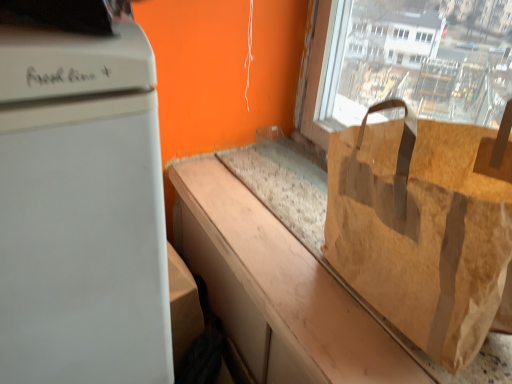
Find the location of `brown paper bag at right`. brown paper bag at right is located at coordinates (424, 226).

There is a brown paper bag at center. Identify the location of grocery bag above it (from a real-world perspective). The image size is (512, 384). (424, 226).

From the image's perspective, is brown paper bag at right above or below brown paper bag at center?

From the image's perspective, brown paper bag at right appears above brown paper bag at center.

Considering the positions of objects white matte refrigerator at left and brown paper bag at center in the image provided, who is more to the right, white matte refrigerator at left or brown paper bag at center?

Positioned to the right is brown paper bag at center.

From the image's perspective, which object appears higher, white matte refrigerator at left or brown paper bag at center?

brown paper bag at center is shown above in the image.

Does point (42, 254) appear closer or farther from the camera than point (200, 235)?

Clearly, point (42, 254) is closer to the camera than point (200, 235).

Is brown paper bag at center not within white matte refrigerator at left?

brown paper bag at center is positioned outside white matte refrigerator at left.

Does brown paper bag at center appear on the right side of white matte refrigerator at left?

Correct, you'll find brown paper bag at center to the right of white matte refrigerator at left.

Is brown paper bag at center bigger or smaller than white matte refrigerator at left?

Considering their sizes, brown paper bag at center takes up less space than white matte refrigerator at left.

Would you say white matte refrigerator at left is to the left or to the right of brown paper bag at right in the picture?

Clearly, white matte refrigerator at left is on the left of brown paper bag at right in the image.

Considering the relative sizes of white matte refrigerator at left and brown paper bag at right in the image provided, is white matte refrigerator at left taller than brown paper bag at right?

Yes, white matte refrigerator at left is taller than brown paper bag at right.

Is white matte refrigerator at left oriented away from brown paper bag at right?

No, brown paper bag at right is not at the back of white matte refrigerator at left.

From the image's perspective, is white matte refrigerator at left above brown paper bag at right?

Incorrect, from the image's perspective, white matte refrigerator at left is lower than brown paper bag at right.

Is brown paper bag at right oriented away from white matte refrigerator at left?

That's not correct — brown paper bag at right is not looking away from white matte refrigerator at left.

Is white matte refrigerator at left surrounded by brown paper bag at right?

No.

Looking at this image, is brown paper bag at right behind white matte refrigerator at left?

Yes, it is.

Considering the relative sizes of brown paper bag at right and white matte refrigerator at left in the image provided, is brown paper bag at right bigger than white matte refrigerator at left?

No.

From the image's perspective, does brown paper bag at center appear lower than brown paper bag at right?

Yes, from the image's perspective, brown paper bag at center is below brown paper bag at right.

Does point (238, 295) come closer to viewer compared to point (461, 216)?

No.

Could you tell me if brown paper bag at center is turned towards brown paper bag at right?

No.

Find the location of `counter top that is on the left side of brown paper bag at right`. counter top that is on the left side of brown paper bag at right is located at coordinates (277, 289).

Find the location of a particular element. The height and width of the screenshot is (384, 512). home appliance below the brown paper bag at center (from the image's perspective) is located at coordinates (81, 210).

From the picture: Estimate the real-world distances between objects in this image. Which object is closer to brown paper bag at right, white matte refrigerator at left or brown paper bag at center?

brown paper bag at center is closer to brown paper bag at right.

When comparing their distances from brown paper bag at right, does brown paper bag at center or white matte refrigerator at left seem closer?

brown paper bag at center lies closer to brown paper bag at right than the other object.

Based on their spatial positions, is brown paper bag at right or brown paper bag at center closer to white matte refrigerator at left?

brown paper bag at center is positioned closer to the anchor white matte refrigerator at left.

When comparing their distances from brown paper bag at center, does white matte refrigerator at left or brown paper bag at right seem further?

Among the two, white matte refrigerator at left is located further to brown paper bag at center.

Considering their positions, is brown paper bag at center positioned closer to white matte refrigerator at left than brown paper bag at right?

brown paper bag at center.

From the image, which object appears to be nearer to brown paper bag at center, brown paper bag at right or white matte refrigerator at left?

brown paper bag at right is closer to brown paper bag at center.

In order to click on counter top situated between white matte refrigerator at left and brown paper bag at right from left to right in this screenshot , I will do `click(277, 289)`.